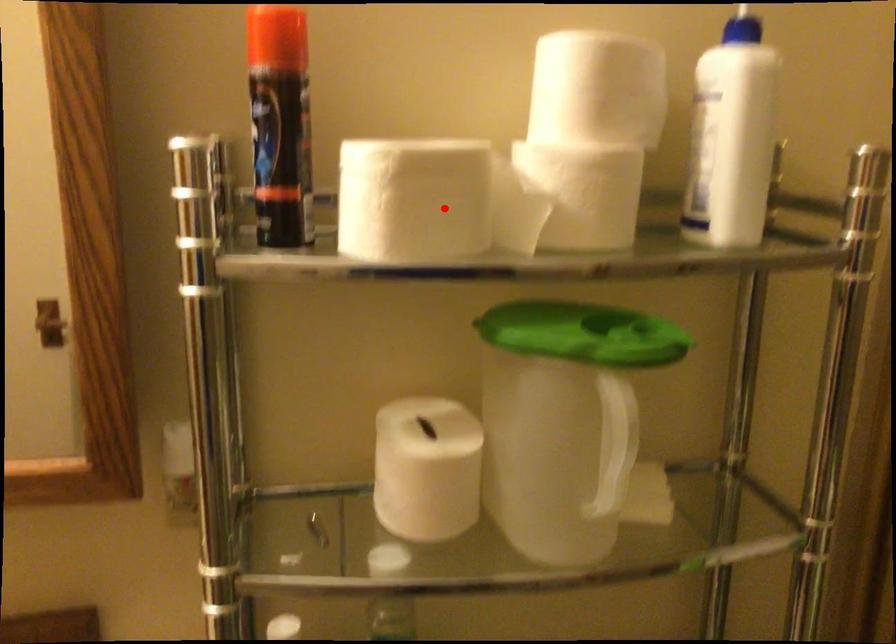
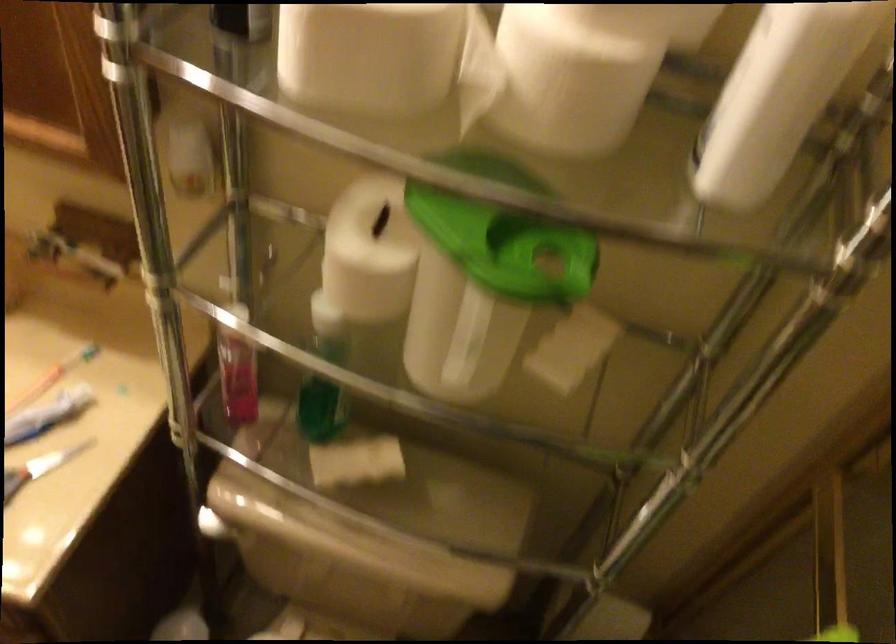
Question: I am providing you with two images of the same scene from different viewpoints. A red point is shown in image1. For the corresponding object point in image2, is it positioned nearer or farther from the camera?

Choices:
 (A) Nearer
 (B) Farther

Answer: (A)